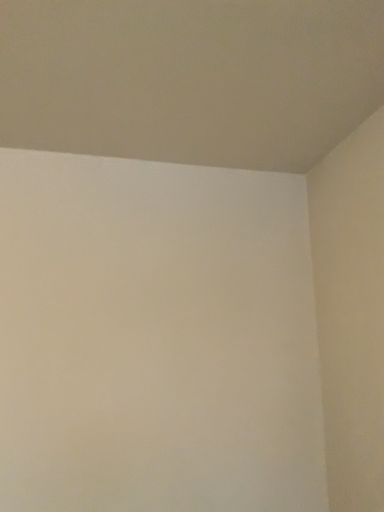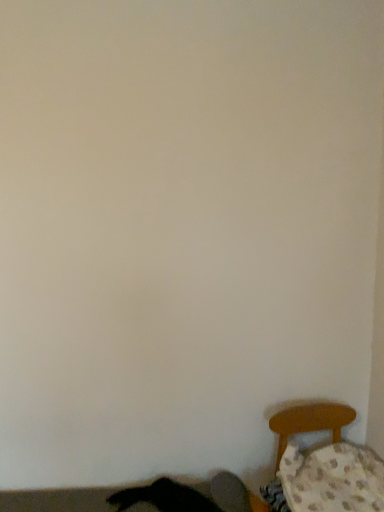
Question: How did the camera likely rotate when shooting the video?

Choices:
 (A) rotated upward
 (B) rotated downward

Answer: (B)